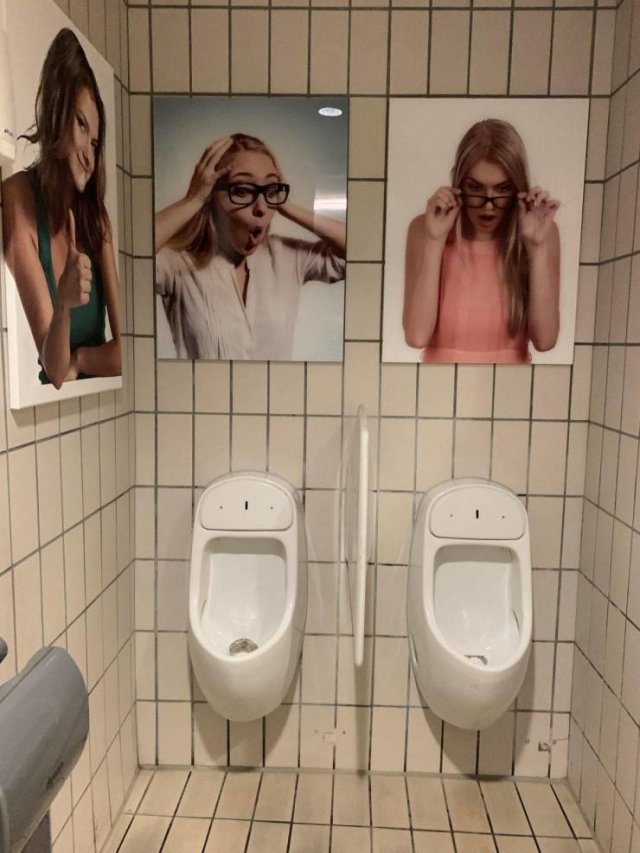
Where is `divider between urinals`? divider between urinals is located at coordinates (363, 520).